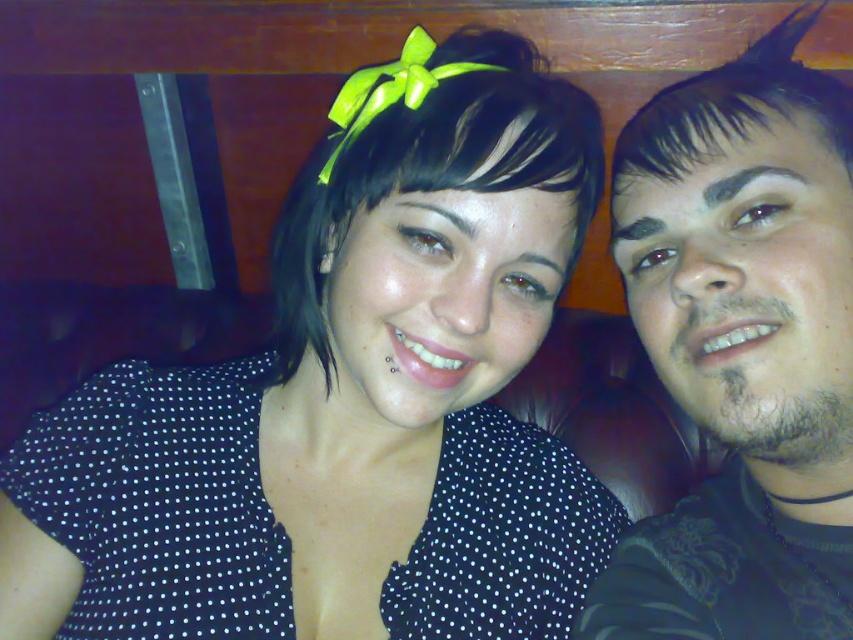
Is point (589, 220) behind point (743, 376)?

Yes, point (589, 220) is behind point (743, 376).

Does black dotted shirt at center have a greater height compared to black matte shirt at right?

Yes, black dotted shirt at center is taller than black matte shirt at right.

Is point (383, 440) more distant than point (776, 144)?

Yes, it is behind point (776, 144).

Identify the location of black dotted shirt at center. This screenshot has height=640, width=853. (347, 400).

Is black dotted shirt at center to the right of dark brown shiny hair at upper right from the viewer's perspective?

No, black dotted shirt at center is not to the right of dark brown shiny hair at upper right.

Which of these two, black dotted shirt at center or dark brown shiny hair at upper right, stands shorter?

Standing shorter between the two is dark brown shiny hair at upper right.

Which is behind, point (86, 400) or point (798, 67)?

Positioned behind is point (86, 400).

I want to click on black dotted shirt at center, so click(x=347, y=400).

Does black matte shirt at right lie in front of dark brown shiny hair at upper right?

Yes, black matte shirt at right is in front of dark brown shiny hair at upper right.

Does point (660, 280) lie behind point (627, 170)?

No.

Locate an element on the screen. black matte shirt at right is located at coordinates (741, 348).